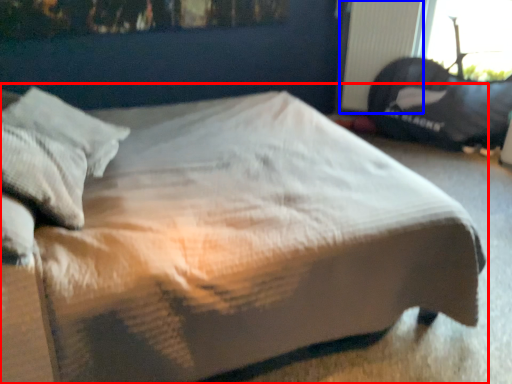
Question: Among these objects, which one is nearest to the camera, bed (highlighted by a red box) or radiator (highlighted by a blue box)?

Choices:
 (A) bed
 (B) radiator

Answer: (A)